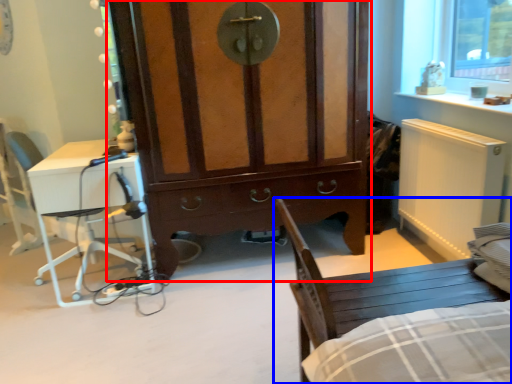
Question: Which object is further to the camera taking this photo, cabinetry (highlighted by a red box) or chair (highlighted by a blue box)?

Choices:
 (A) cabinetry
 (B) chair

Answer: (A)